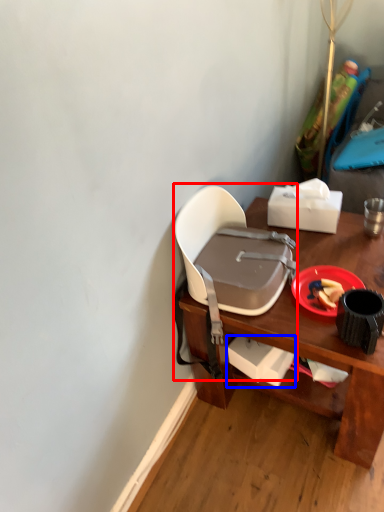
Question: Which object is further to the camera taking this photo, chair (highlighted by a red box) or box (highlighted by a blue box)?

Choices:
 (A) chair
 (B) box

Answer: (B)